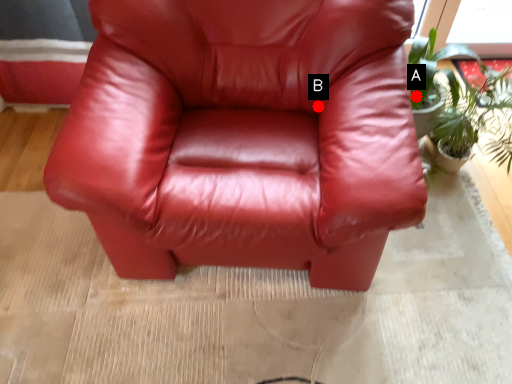
Question: Two points are circled on the image, labeled by A and B beside each circle. Which point appears farthest from the camera in this image?

Choices:
 (A) A is further
 (B) B is further

Answer: (A)